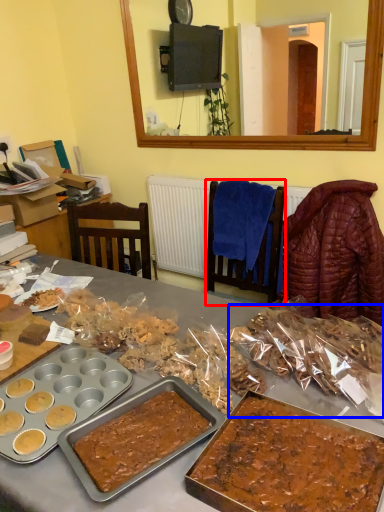
Question: Which of the following is the farthest to the observer, chair (highlighted by a red box) or snack (highlighted by a blue box)?

Choices:
 (A) chair
 (B) snack

Answer: (A)